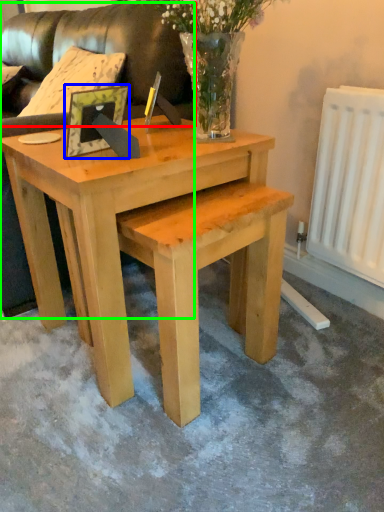
Question: Based on their relative distances, which object is farther from couch (highlighted by a red box)? Choose from picture frame (highlighted by a blue box) and couch (highlighted by a green box).

Choices:
 (A) picture frame
 (B) couch

Answer: (A)